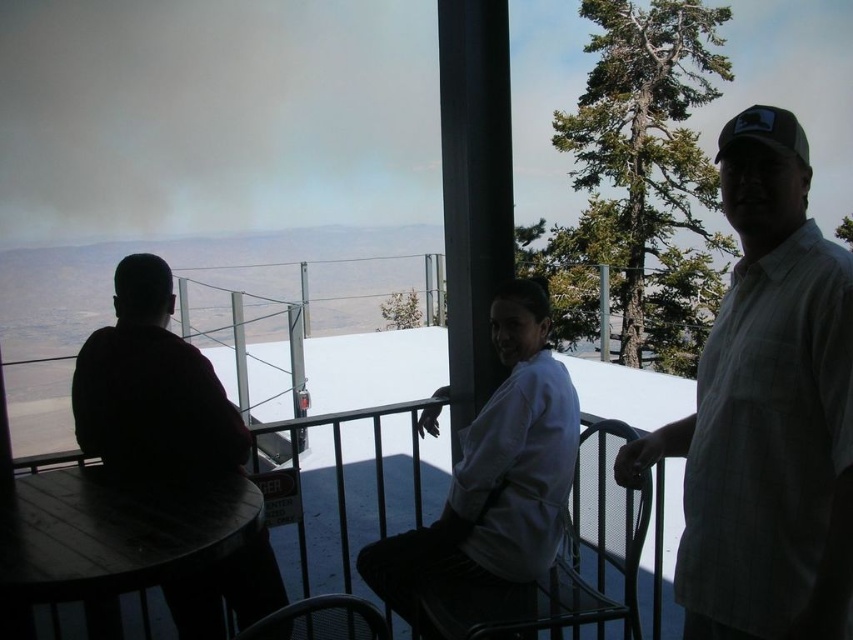
You are a photographer trying to capture a group photo of the two people on the balcony. You notice the white checkered shirt at right and the dark matte shirt at left. Which person should you ask to move closer to the center to balance the composition, considering their sizes?

The white checkered shirt at right is thinner than the dark matte shirt at left. To balance the composition, you should ask the white checkered shirt at right to move closer to the center since they are thinner and need to occupy more space visually.

You are a photographer trying to capture a clear shot of the white cotton shirt at center and the wooden table at center from your position on the balcony. Which object will appear bigger in your photo?

The white cotton shirt at center will appear bigger in the photo because it is larger in size than the wooden table at center according to the description.